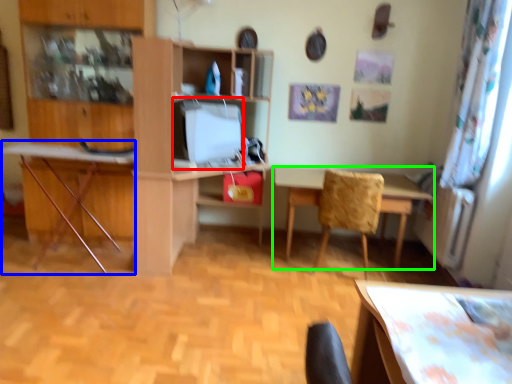
Question: Which object is the farthest from computer monitor (highlighted by a red box)? Choose among these: computer desk (highlighted by a blue box) or table (highlighted by a green box).

Choices:
 (A) computer desk
 (B) table

Answer: (B)